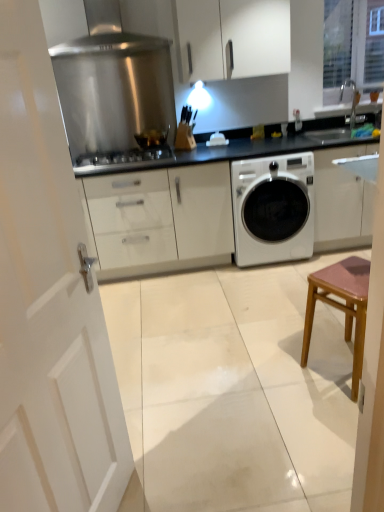
Question: In the image, is white wooden door at left positioned in front of or behind clear glass window at upper right?

Choices:
 (A) front
 (B) behind

Answer: (A)

Question: In terms of width, does white wooden door at left look wider or thinner when compared to clear glass window at upper right?

Choices:
 (A) thin
 (B) wide

Answer: (B)

Question: Which is farther from the black glossy sink at upper right?

Choices:
 (A) stainless steel gas stove at center
 (B) white matte washing machine at center
 (C) clear glass window at upper right
 (D) white wooden door at left
 (E) white glossy cabinet at upper center

Answer: (D)

Question: Estimate the real-world distances between objects in this image. Which object is farther from the pink wood stool at right?

Choices:
 (A) white glossy cabinet at upper center
 (B) white matte washing machine at center
 (C) clear glass window at upper right
 (D) translucent glass cup at center
 (E) black glossy sink at upper right

Answer: (C)